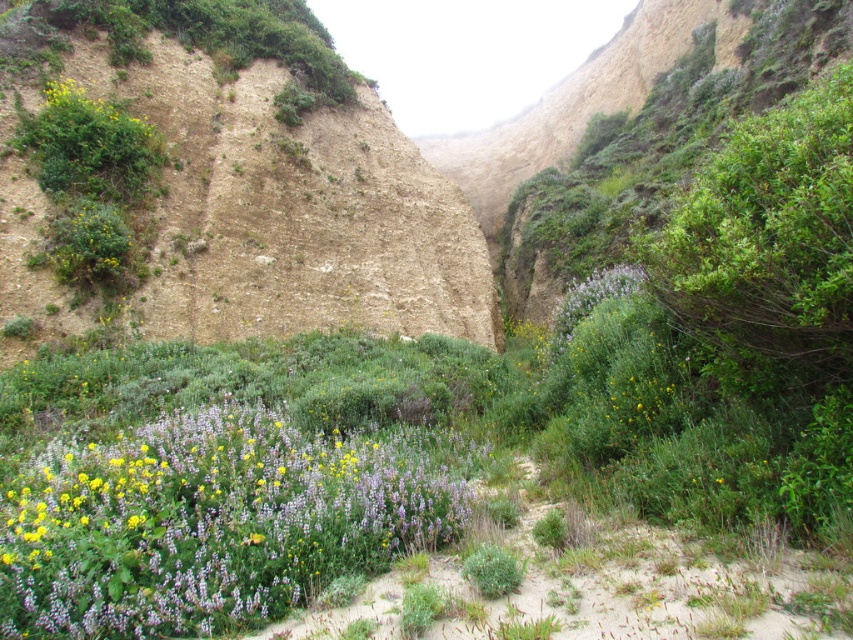
Question: Which of the following is the closest to the observer?

Choices:
 (A) yellow matte flower at upper left
 (B) purple matte flowers at center

Answer: (B)

Question: Which point is farther to the camera?

Choices:
 (A) (x=67, y=120)
 (B) (x=154, y=467)

Answer: (A)

Question: Does purple matte flowers at center appear on the left side of yellow matte flower at upper left?

Choices:
 (A) no
 (B) yes

Answer: (A)

Question: Is the position of purple matte flowers at center less distant than that of yellow matte flower at upper left?

Choices:
 (A) yes
 (B) no

Answer: (A)

Question: Can you confirm if purple matte flowers at center is positioned to the left of yellow matte flower at upper left?

Choices:
 (A) yes
 (B) no

Answer: (B)